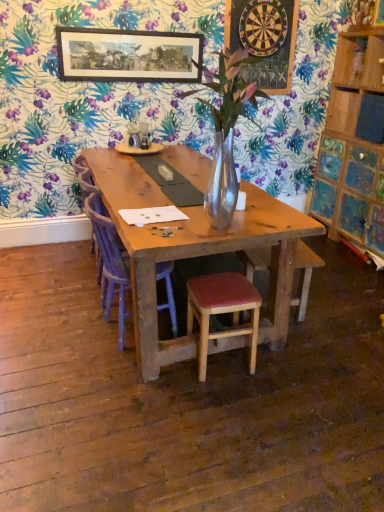
Question: Is the depth of wooden framed print at upper center greater than that of wooden stool with red cushion at center?

Choices:
 (A) no
 (B) yes

Answer: (B)

Question: Would you say wooden framed print at upper center is a long distance from wooden stool with red cushion at center?

Choices:
 (A) no
 (B) yes

Answer: (B)

Question: Can you confirm if wooden framed print at upper center is positioned to the right of wooden stool with red cushion at center?

Choices:
 (A) no
 (B) yes

Answer: (A)

Question: Does wooden framed print at upper center have a larger size compared to wooden stool with red cushion at center?

Choices:
 (A) no
 (B) yes

Answer: (A)

Question: From the image's perspective, is wooden framed print at upper center located above wooden stool with red cushion at center?

Choices:
 (A) yes
 (B) no

Answer: (A)

Question: In terms of width, does purple wood chair at center look wider or thinner when compared to wooden stool with red cushion at center?

Choices:
 (A) thin
 (B) wide

Answer: (B)

Question: From a real-world perspective, relative to wooden stool with red cushion at center, is purple wood chair at center vertically above or below?

Choices:
 (A) above
 (B) below

Answer: (A)

Question: Is purple wood chair at center in front of or behind wooden stool with red cushion at center in the image?

Choices:
 (A) front
 (B) behind

Answer: (B)

Question: Would you say purple wood chair at center is to the left or to the right of wooden stool with red cushion at center in the picture?

Choices:
 (A) right
 (B) left

Answer: (B)

Question: Considering the positions of purple fabric armchair at center and wooden dartboard at upper center in the image, is purple fabric armchair at center taller or shorter than wooden dartboard at upper center?

Choices:
 (A) tall
 (B) short

Answer: (A)

Question: Considering the positions of purple fabric armchair at center and wooden dartboard at upper center in the image, is purple fabric armchair at center bigger or smaller than wooden dartboard at upper center?

Choices:
 (A) small
 (B) big

Answer: (B)

Question: In terms of width, does purple fabric armchair at center look wider or thinner when compared to wooden dartboard at upper center?

Choices:
 (A) thin
 (B) wide

Answer: (B)

Question: Is point (94, 244) closer or farther from the camera than point (238, 47)?

Choices:
 (A) farther
 (B) closer

Answer: (B)

Question: Looking at their shapes, would you say purple wood chair at center is wider or thinner than wooden framed print at upper center?

Choices:
 (A) thin
 (B) wide

Answer: (B)

Question: Is purple wood chair at center inside or outside of wooden framed print at upper center?

Choices:
 (A) inside
 (B) outside

Answer: (B)